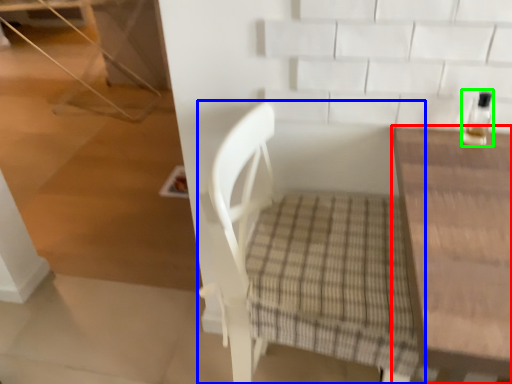
Question: Which is farther away from table (highlighted by a red box)? chair (highlighted by a blue box) or bottle (highlighted by a green box)?

Choices:
 (A) chair
 (B) bottle

Answer: (A)